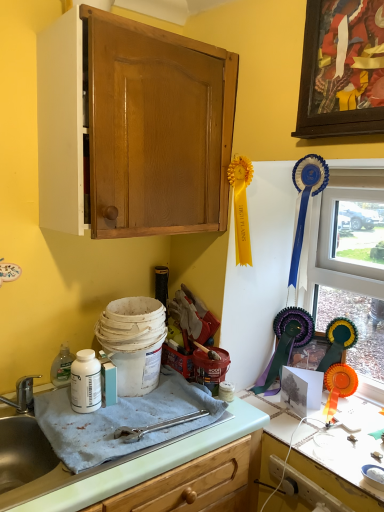
Question: In terms of width, does matte wood cabinet at upper left look wider or thinner when compared to wooden picture frame at upper right?

Choices:
 (A) wide
 (B) thin

Answer: (A)

Question: Which is correct: matte wood cabinet at upper left is inside wooden picture frame at upper right, or outside of it?

Choices:
 (A) outside
 (B) inside

Answer: (A)

Question: Which is nearer to the light green laminate countertop at lower center, which appears as the second countertop when viewed from the right?

Choices:
 (A) white matte bottle at lower left
 (B) white glossy countertop at lower right, positioned as the first countertop in right-to-left order
 (C) wooden picture frame at upper right
 (D) blue ribbon at upper right
 (E) clear glass window at right

Answer: (B)

Question: Which object is positioned farthest from the light green laminate countertop at lower center, marked as the 1th countertop in a left-to-right arrangement?

Choices:
 (A) white glossy countertop at lower right, which appears as the second countertop when viewed from the left
 (B) white matte bottle at lower left
 (C) clear glass window at right
 (D) blue ribbon at upper right
 (E) matte wood cabinet at upper left

Answer: (E)